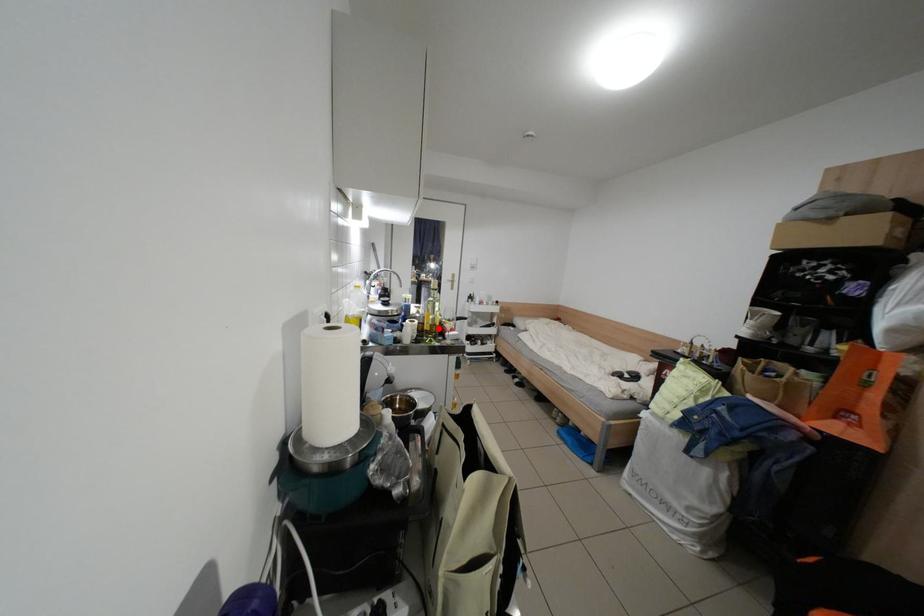
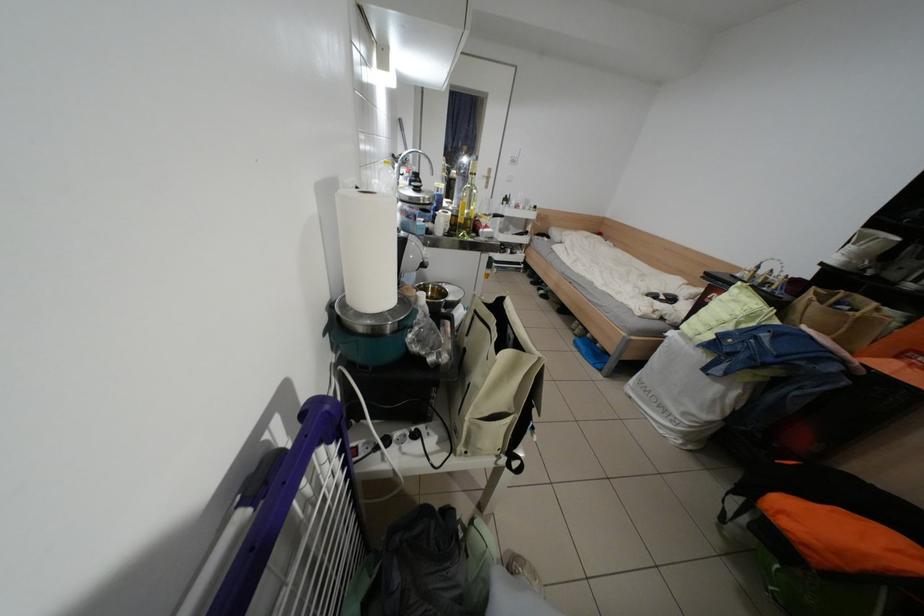
Question: A red point is marked in image1. In image2, is the corresponding 3D point closer to the camera or farther? Reply with the corresponding letter.

Choices:
 (A) The corresponding 3D point is closer.
 (B) The corresponding 3D point is farther.

Answer: (A)